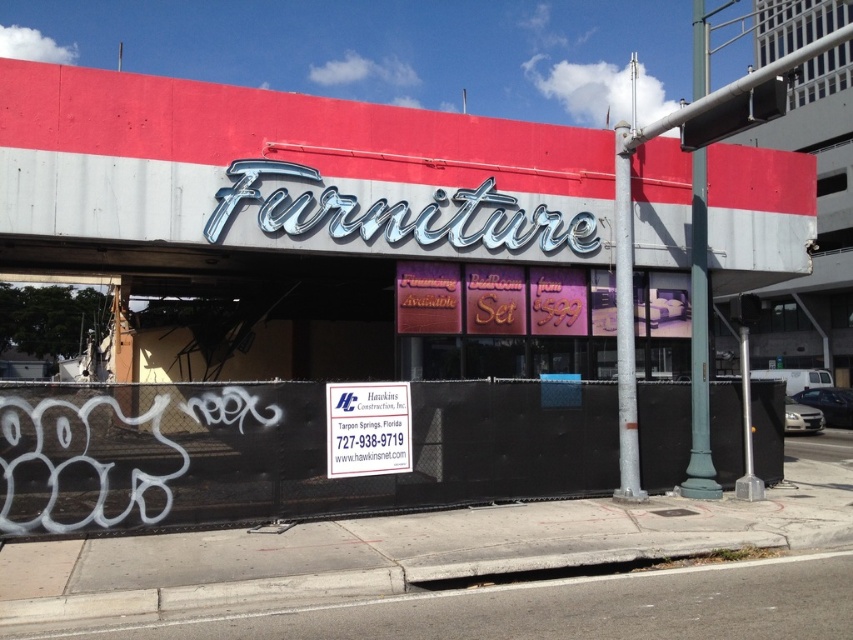
You are a customer passing by the furniture store and notice both the metallic signboard at center and the white plastic sign at center. Which sign is positioned more to the left from your perspective?

The metallic signboard at center is positioned more to the left than the white plastic sign at center.

You are a delivery person trying to locate the entrance to the furniture store. The entrance is behind the white plastic sign at center. Can you see the metallic signboard at center from the entrance?

The metallic signboard at center is located above the white plastic sign at center, so yes, you can see the metallic signboard at center from the entrance as it is positioned above the white plastic sign at center.

You are a delivery person trying to read the contact information on the white plastic sign at center. Since the metallic signboard at center is blocking your view, can you move to the left to get a better look? Explain why or why not based on their sizes.

The metallic signboard at center is taller than the white plastic sign at center, so moving to the left might still be partially blocked by the taller metallic signboard at center unless you move far enough away to see around it.